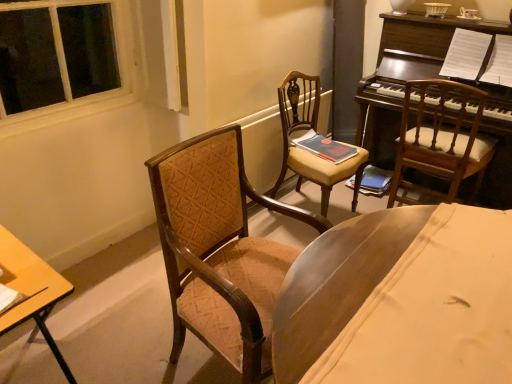
Question: Is matte brown wooden chair at center, which is counted as the 2th chair, starting from the right, outside of matte red book at center, marked as the 1th book in a left-to-right arrangement?

Choices:
 (A) yes
 (B) no

Answer: (A)

Question: Is matte brown wooden chair at center, which is the second chair from left to right, to the right of matte red book at center, the 2th book when ordered from right to left, from the viewer's perspective?

Choices:
 (A) yes
 (B) no

Answer: (B)

Question: From the image's perspective, is matte brown wooden chair at center, which is counted as the 2th chair, starting from the right, located above matte red book at center, marked as the 1th book in a left-to-right arrangement?

Choices:
 (A) yes
 (B) no

Answer: (B)

Question: From the image's perspective, would you say matte brown wooden chair at center, which is the second chair from left to right, is shown under matte red book at center, which is the 2th book in back-to-front order?

Choices:
 (A) yes
 (B) no

Answer: (A)

Question: From a real-world perspective, is matte brown wooden chair at center, which is the second chair from left to right, physically above matte red book at center, which is the 2th book in back-to-front order?

Choices:
 (A) yes
 (B) no

Answer: (B)

Question: Considering the relative sizes of matte brown wooden chair at center, which is the second chair from left to right, and matte red book at center, marked as the 1th book in a left-to-right arrangement, in the image provided, is matte brown wooden chair at center, which is the second chair from left to right, thinner than matte red book at center, marked as the 1th book in a left-to-right arrangement,?

Choices:
 (A) no
 (B) yes

Answer: (A)

Question: From the image's perspective, would you say dark brown polished wood piano at upper right is shown under hardcover book at center, positioned as the 2th book in front-to-back order?

Choices:
 (A) no
 (B) yes

Answer: (A)

Question: Is dark brown polished wood piano at upper right oriented towards hardcover book at center, the 1th book positioned from the right?

Choices:
 (A) yes
 (B) no

Answer: (A)

Question: Considering the relative positions of dark brown polished wood piano at upper right and hardcover book at center, which is counted as the first book, starting from the back, in the image provided, is dark brown polished wood piano at upper right behind hardcover book at center, which is counted as the first book, starting from the back,?

Choices:
 (A) yes
 (B) no

Answer: (B)

Question: Is dark brown polished wood piano at upper right outside hardcover book at center, the 1th book positioned from the right?

Choices:
 (A) yes
 (B) no

Answer: (A)

Question: Does dark brown polished wood piano at upper right have a larger size compared to hardcover book at center, the second book when ordered from left to right?

Choices:
 (A) yes
 (B) no

Answer: (A)

Question: Can you confirm if dark brown polished wood piano at upper right is wider than hardcover book at center, the 1th book positioned from the right?

Choices:
 (A) yes
 (B) no

Answer: (A)

Question: Considering the relative sizes of velvet brown armchair at center, positioned as the 1th chair in left-to-right order, and wooden desk at lower left in the image provided, is velvet brown armchair at center, positioned as the 1th chair in left-to-right order, wider than wooden desk at lower left?

Choices:
 (A) yes
 (B) no

Answer: (B)